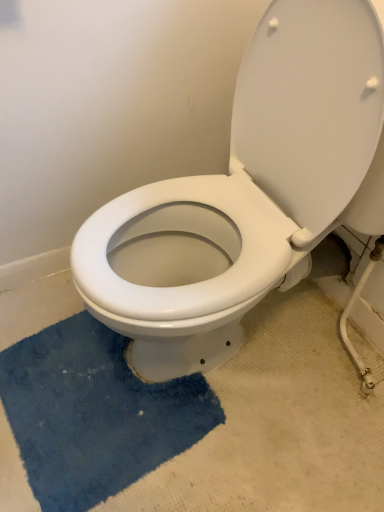
Where is `empty space that is to the right of blue plush bath mat at lower left`? empty space that is to the right of blue plush bath mat at lower left is located at coordinates (275, 432).